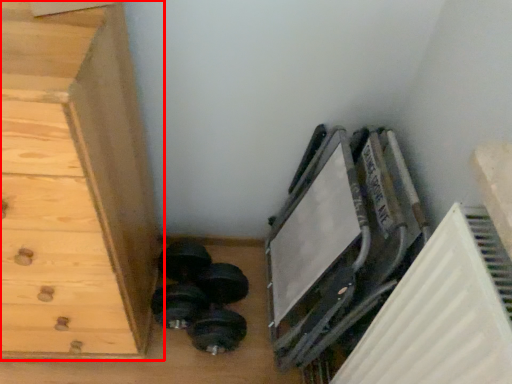
Question: From the image's perspective, where is chest of drawers (annotated by the red box) located relative to dumbbell?

Choices:
 (A) above
 (B) below

Answer: (A)